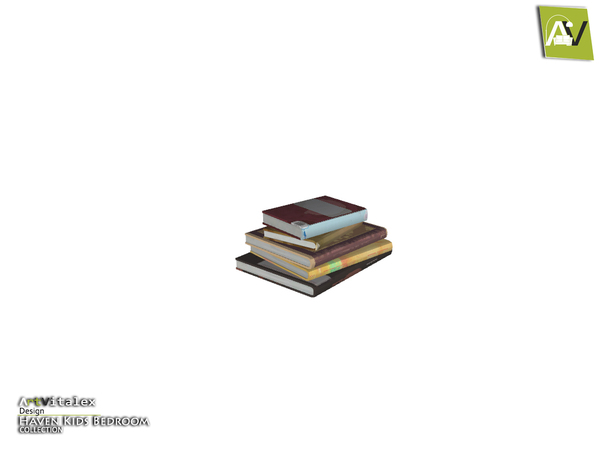
Locate an element on the screen. Image resolution: width=600 pixels, height=450 pixels. couch is located at coordinates (562, 42).